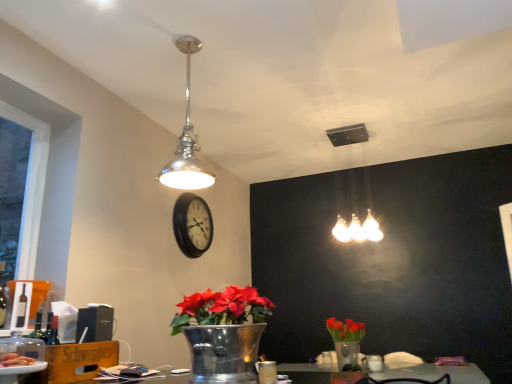
Question: Is white frosted glass light fixture at upper center, which appears as the 1th lamp when viewed from the back, to the right of black wooden clock at center from the viewer's perspective?

Choices:
 (A) no
 (B) yes

Answer: (B)

Question: Is white frosted glass light fixture at upper center, which is counted as the 2th lamp, starting from the left, far from black wooden clock at center?

Choices:
 (A) no
 (B) yes

Answer: (B)

Question: Can you confirm if white frosted glass light fixture at upper center, which is counted as the 2th lamp, starting from the left, is wider than black wooden clock at center?

Choices:
 (A) no
 (B) yes

Answer: (B)

Question: Is white frosted glass light fixture at upper center, which is counted as the 2th lamp, starting from the left, positioned with its back to black wooden clock at center?

Choices:
 (A) no
 (B) yes

Answer: (A)

Question: Does white frosted glass light fixture at upper center, marked as the first lamp in a right-to-left arrangement, have a lesser height compared to black wooden clock at center?

Choices:
 (A) yes
 (B) no

Answer: (B)

Question: From a real-world perspective, relative to metallic silver vase with red flowers at lower right, is translucent plastic plate at lower left vertically above or below?

Choices:
 (A) above
 (B) below

Answer: (A)

Question: Is translucent plastic plate at lower left taller or shorter than metallic silver vase with red flowers at lower right?

Choices:
 (A) tall
 (B) short

Answer: (B)

Question: Is translucent plastic plate at lower left situated inside metallic silver vase with red flowers at lower right or outside?

Choices:
 (A) outside
 (B) inside

Answer: (A)

Question: Relative to metallic silver vase with red flowers at lower right, is translucent plastic plate at lower left in front or behind?

Choices:
 (A) front
 (B) behind

Answer: (A)

Question: Is point (362, 331) positioned closer to the camera than point (180, 203)?

Choices:
 (A) farther
 (B) closer

Answer: (A)

Question: Considering the positions of metallic silver vase with red flowers at lower right and black wooden clock at center in the image, is metallic silver vase with red flowers at lower right taller or shorter than black wooden clock at center?

Choices:
 (A) tall
 (B) short

Answer: (B)

Question: Relative to black wooden clock at center, is metallic silver vase with red flowers at lower right in front or behind?

Choices:
 (A) front
 (B) behind

Answer: (A)

Question: From the image's perspective, is metallic silver vase with red flowers at lower right located above or below black wooden clock at center?

Choices:
 (A) below
 (B) above

Answer: (A)

Question: Considering the positions of translucent plastic plate at lower left and white frosted glass light fixture at upper center, which is counted as the second lamp, starting from the front, in the image, is translucent plastic plate at lower left taller or shorter than white frosted glass light fixture at upper center, which is counted as the second lamp, starting from the front,?

Choices:
 (A) tall
 (B) short

Answer: (B)

Question: Considering the positions of point (11, 355) and point (351, 127), is point (11, 355) closer or farther from the camera than point (351, 127)?

Choices:
 (A) closer
 (B) farther

Answer: (A)